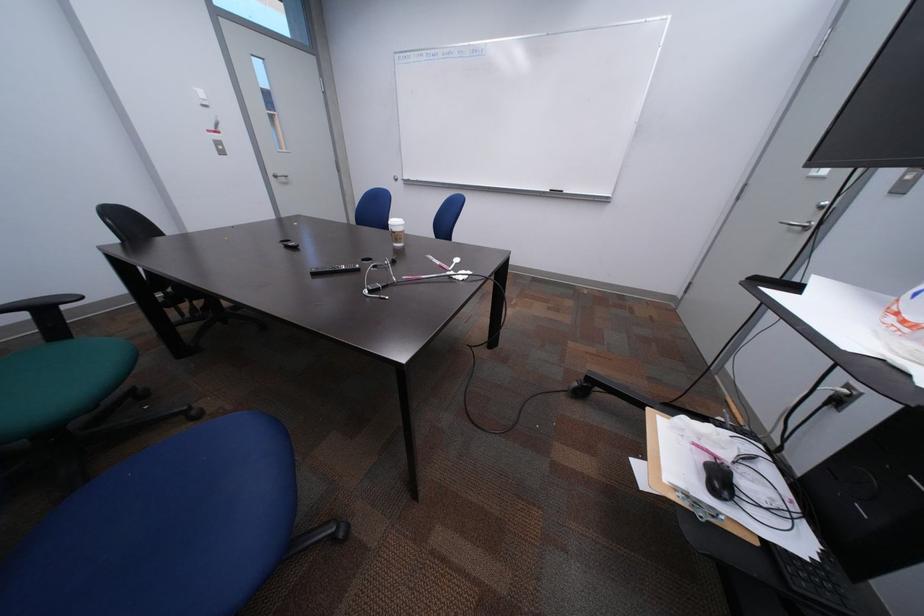
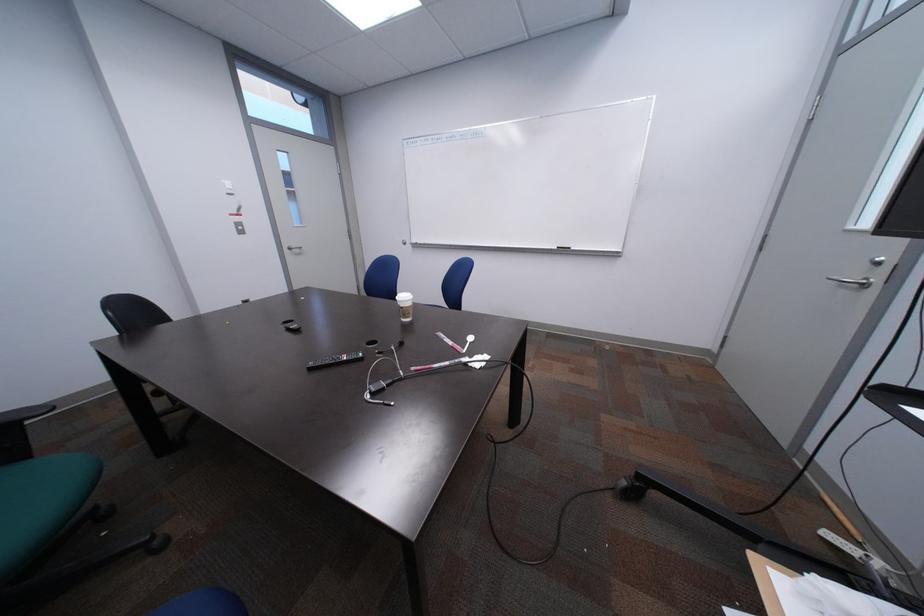
Question: The images are taken continuously from a first-person perspective. In which direction are you moving?

Choices:
 (A) Left
 (B) Right
 (C) Forward
 (D) Backward

Answer: (C)